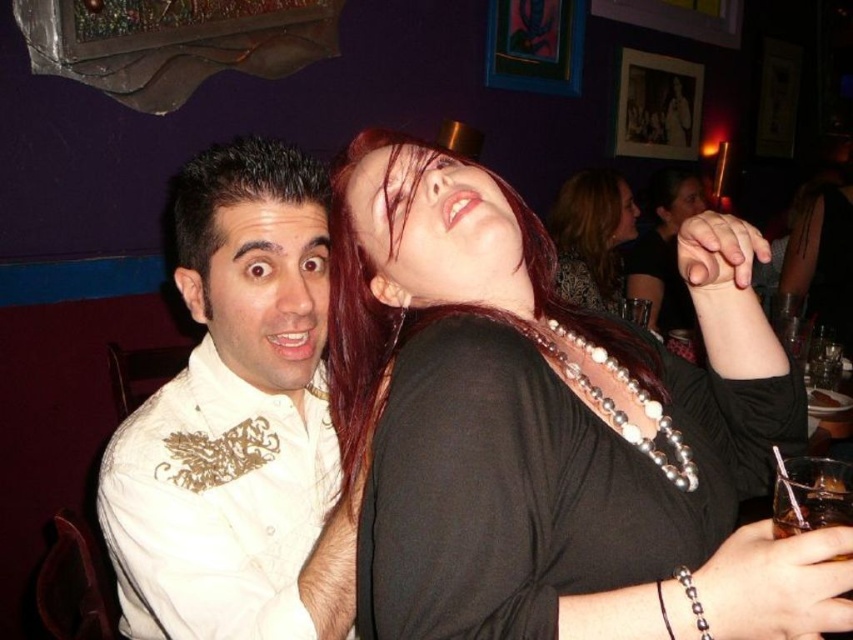
Question: Among these points, which one is farthest from the camera?

Choices:
 (A) (635, 216)
 (B) (337, 193)

Answer: (A)

Question: Does black pearl necklace at upper right appear under shiny black necklace at upper center?

Choices:
 (A) yes
 (B) no

Answer: (A)

Question: Which of the following is the closest to the observer?

Choices:
 (A) shiny black necklace at upper center
 (B) black pearl necklace at upper right

Answer: (B)

Question: Which object appears farthest from the camera in this image?

Choices:
 (A) white embroidered shirt at left
 (B) pearl beaded necklace at upper center
 (C) black pearl necklace at upper right
 (D) shiny black necklace at upper center

Answer: (D)

Question: Considering the relative positions of black pearl necklace at upper right and shiny black necklace at upper center in the image provided, where is black pearl necklace at upper right located with respect to shiny black necklace at upper center?

Choices:
 (A) left
 (B) right

Answer: (A)

Question: Considering the relative positions of black pearl necklace at upper right and shiny black necklace at upper center in the image provided, where is black pearl necklace at upper right located with respect to shiny black necklace at upper center?

Choices:
 (A) left
 (B) right

Answer: (A)